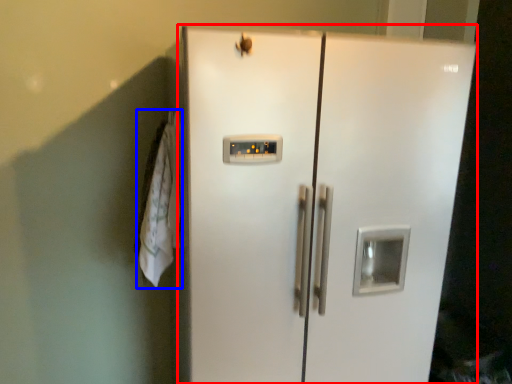
Question: Which object appears closest to the camera in this image, refrigerator (highlighted by a red box) or laundry (highlighted by a blue box)?

Choices:
 (A) refrigerator
 (B) laundry

Answer: (A)